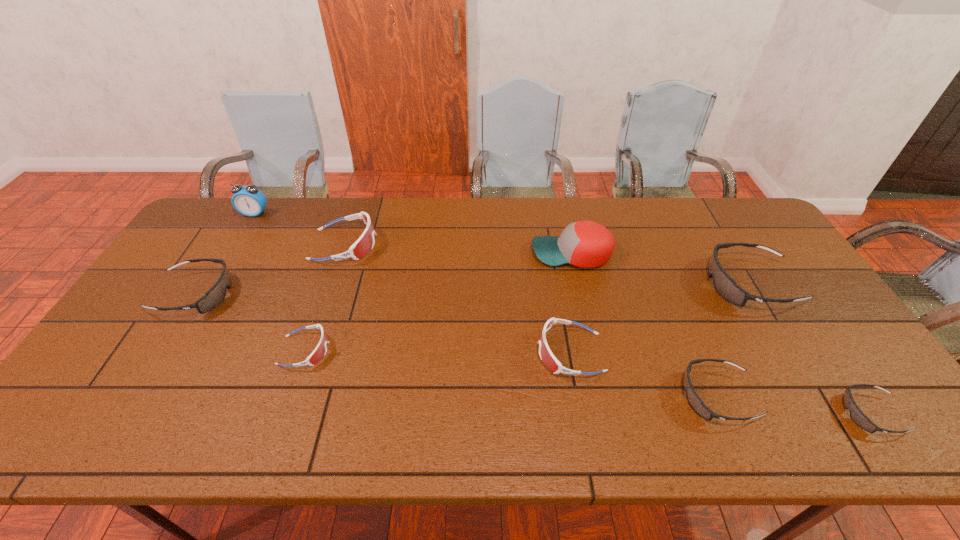
Identify the location of the smallest red goggles. This screenshot has height=540, width=960. (320, 351).

You are a GUI agent. You are given a task and a screenshot of the screen. Output one action in this format:
    pyautogui.click(x=<x>, y=<y>)
    Task: Click on the shortest goggles
    
    Given the screenshot: What is the action you would take?
    pyautogui.click(x=857, y=416)

Find the location of a particular element. The height and width of the screenshot is (540, 960). the smallest black goggles is located at coordinates (857, 416).

The width and height of the screenshot is (960, 540). Identify the location of free location located 0.270m on the face of the alarm clock. (220, 272).

At what (x,y) coordinates should I click in order to perform the action: click on free space located at the brim of the red baseball cap. Please return your answer as a coordinate pair (x, y). The image size is (960, 540). Looking at the image, I should click on (513, 253).

The width and height of the screenshot is (960, 540). Identify the location of vacant space situated 0.170m at the brim of the red baseball cap. (478, 253).

At what (x,y) coordinates should I click in order to perform the action: click on vacant area located 0.230m at the brim of the red baseball cap. Please return your answer as a coordinate pair (x, y). The image size is (960, 540). Looking at the image, I should click on (459, 253).

The image size is (960, 540). In order to click on vacant position located 0.220m on the front-facing side of the farthest red goggles in this screenshot , I will do `click(445, 245)`.

The width and height of the screenshot is (960, 540). I want to click on blank space located on the lenses of the biggest black goggles, so click(683, 285).

Find the location of a particular element. The width and height of the screenshot is (960, 540). vacant space located on the lenses of the biggest black goggles is located at coordinates (662, 285).